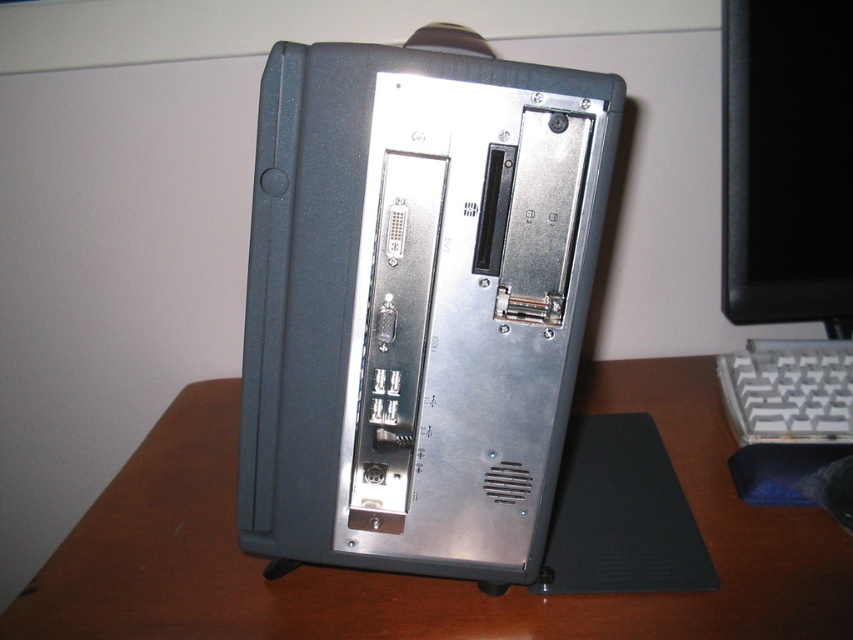
Is satin black computer at center positioned in front of brown wood computer desk at center?

Yes.

Does satin black computer at center have a larger size compared to brown wood computer desk at center?

Incorrect, satin black computer at center is not larger than brown wood computer desk at center.

What are the coordinates of `satin black computer at center` in the screenshot? It's located at (416, 305).

Does brown wood computer desk at center have a greater width compared to white plastic keyboard at lower right?

Correct, the width of brown wood computer desk at center exceeds that of white plastic keyboard at lower right.

Is brown wood computer desk at center bigger than white plastic keyboard at lower right?

Correct, brown wood computer desk at center is larger in size than white plastic keyboard at lower right.

Which is behind, point (506, 602) or point (842, 355)?

The point (842, 355) is behind.

Find the location of a particular element. brown wood computer desk at center is located at coordinates pyautogui.click(x=422, y=577).

Does satin black computer at center have a lesser height compared to white plastic keyboard at lower right?

No.

Does point (427, 275) come closer to viewer compared to point (785, 346)?

Yes, it is in front of point (785, 346).

In order to click on satin black computer at center in this screenshot , I will do `click(416, 305)`.